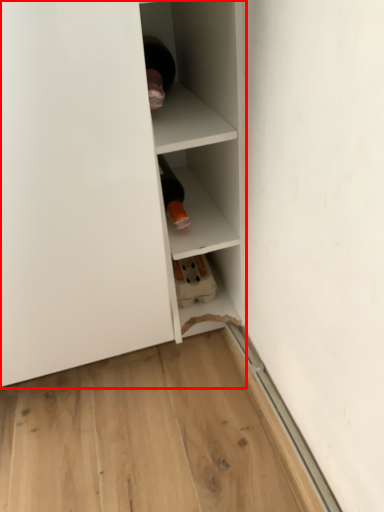
Question: From the image's perspective, where is shelf (annotated by the red box) located relative to shelf?

Choices:
 (A) above
 (B) below

Answer: (B)